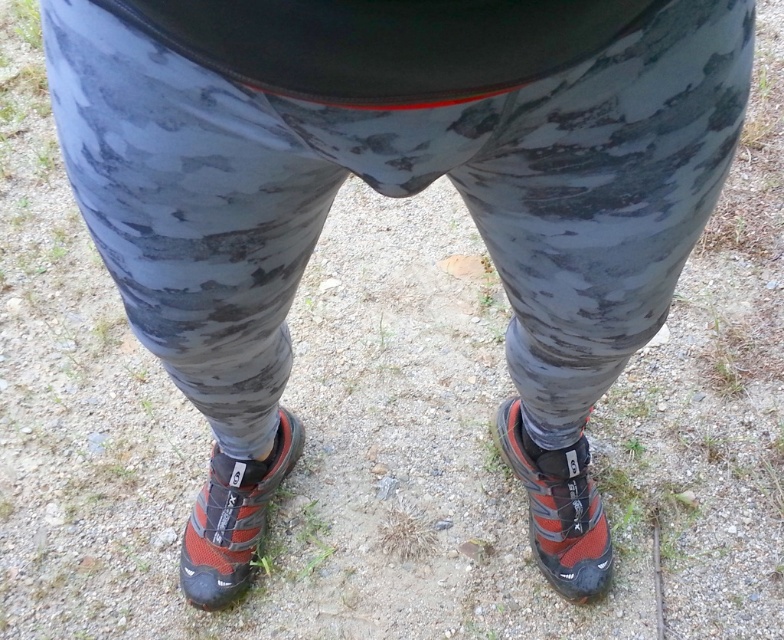
From the picture: You are a photographer trying to capture the matte orange shoe at lower center in the image. The camera is positioned at point (233, 516). Will the camera be able to clearly see the matte orange shoe at lower center?

The point (233, 516) marks the matte orange shoe at lower center, so yes, the camera positioned there will be able to clearly see the matte orange shoe at lower center.

You are standing 1.5 meters away from a point marked at coordinates (505, 438). Can you reach this point without moving your feet?

The distance between you and the point is 1.42 meters, which is less than 1.5 meters. Therefore, you can reach the point without moving your feet.

You are standing in a forest path and notice a red mesh shoe at lower right. If you want to pick it up, how many steps do you need to take forward to reach it, assuming each step covers 0.75 meters?

The distance between you and the red mesh shoe at lower right is 1.26 meters. Since each step covers 0.75 meters, you would need to take 2 steps to cover the distance, as 0.75 multiplied by 2 equals 1.5 meters, which is slightly more than the required 1.26 meters. However, since you can adjust your final step, 2 steps would be sufficient.